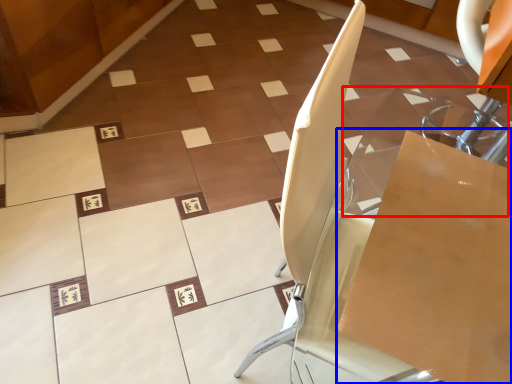
Question: Among these objects, which one is nearest to the camera, glass table (highlighted by a red box) or cardboard box (highlighted by a blue box)?

Choices:
 (A) glass table
 (B) cardboard box

Answer: (B)